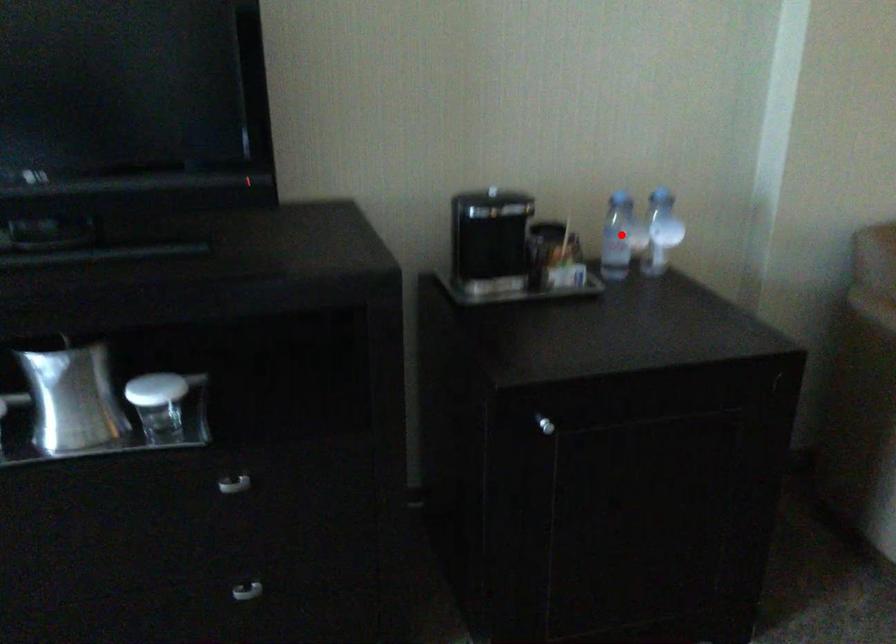
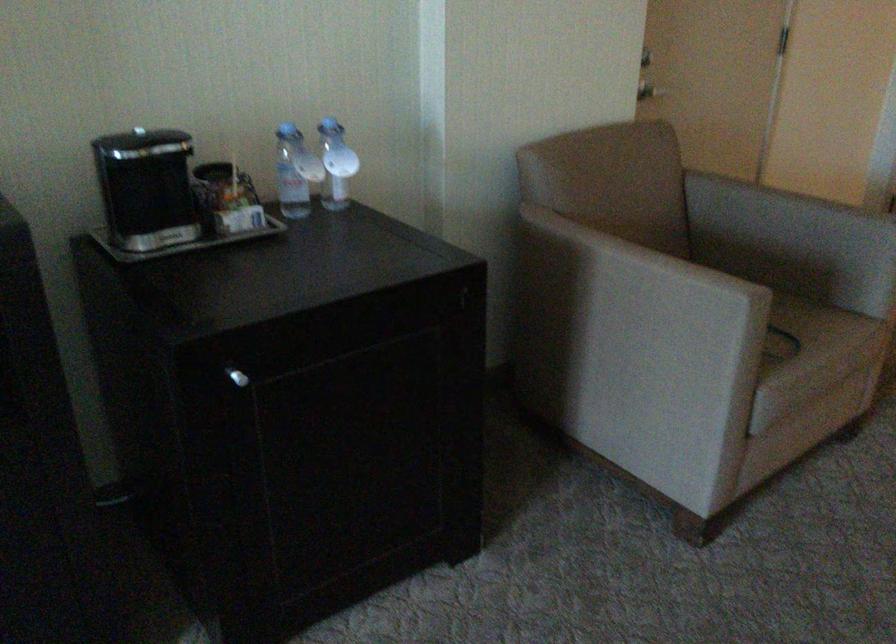
Find the pixel in the second image that matches the highlighted location in the first image.

(295, 172)